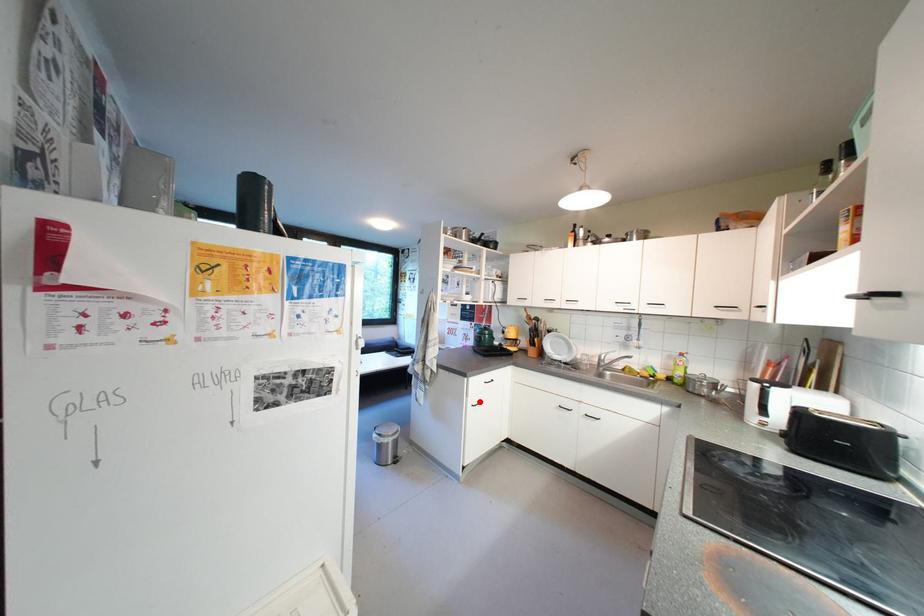
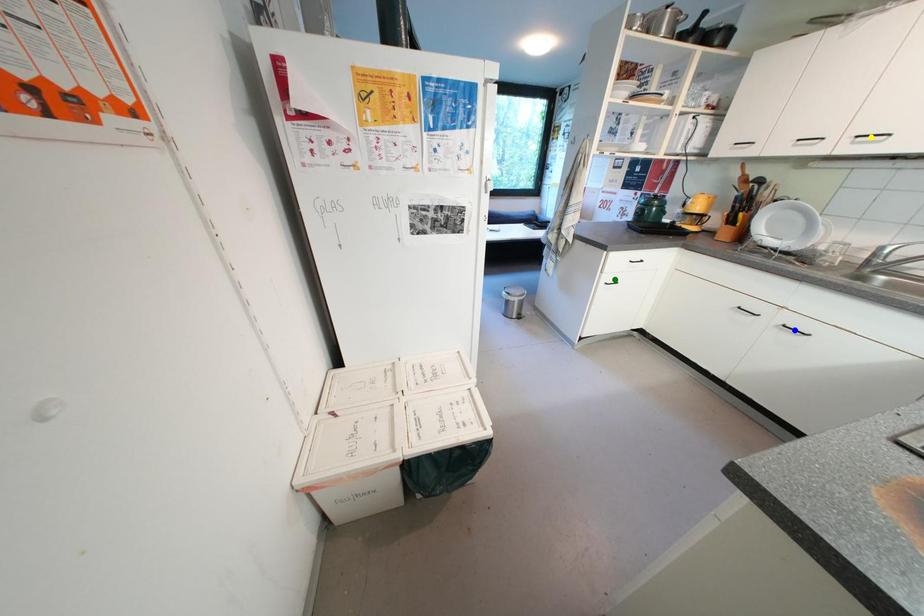
Question: I am providing you with two images of the same scene from different viewpoints. A red point is marked on the first image. You are given multiple points on the second image. Can you choose the point in image 2 that corresponds to the point in image 1?

Choices:
 (A) yellow point
 (B) green point
 (C) blue point

Answer: (B)